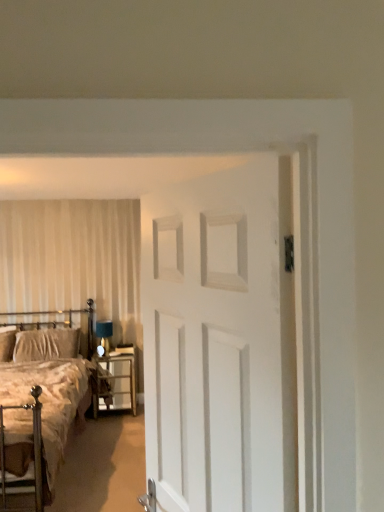
In order to face metallic silver nightstand at lower center, should I rotate leftwards or rightwards?

You should rotate left by 10.150 degrees.

Find the location of `metallic gold bed at left`. metallic gold bed at left is located at coordinates (41, 409).

In order to face white matte door at center, should I rotate leftwards or rightwards?

Turn right by 0.154 degrees to look at white matte door at center.

The height and width of the screenshot is (512, 384). I want to click on velvet beige pillow at left, so click(x=46, y=344).

The width and height of the screenshot is (384, 512). What do you see at coordinates (46, 344) in the screenshot? I see `velvet beige pillow at left` at bounding box center [46, 344].

Identify the location of metallic silver nightstand at lower center. (116, 381).

Is metallic silver headboard at left in front of or behind velvet beige pillow at left in the image?

In the image, metallic silver headboard at left appears in front of velvet beige pillow at left.

Is metallic silver headboard at left with velvet beige pillow at left?

Yes, metallic silver headboard at left and velvet beige pillow at left clearly make contact.

Would you say metallic silver headboard at left is inside or outside velvet beige pillow at left?

metallic silver headboard at left is contained in velvet beige pillow at left.

Is point (20, 330) behind point (76, 349)?

No, (20, 330) is in front of (76, 349).

Which point is more distant from viewer, (127, 397) or (45, 346)?

Point (127, 397)

Between metallic silver nightstand at lower center and metallic silver headboard at left, which one has smaller width?

Thinner between the two is metallic silver headboard at left.

From a real-world perspective, relative to metallic silver headboard at left, is metallic silver nightstand at lower center vertically above or below?

metallic silver nightstand at lower center is below metallic silver headboard at left.

Between metallic silver nightstand at lower center and metallic silver headboard at left, which one has larger size?

metallic silver headboard at left.

From the image's perspective, relative to metallic silver nightstand at lower center, is metallic silver headboard at left above or below?

metallic silver headboard at left is above metallic silver nightstand at lower center.

In the scene shown: From their relative heights in the image, would you say metallic silver headboard at left is taller or shorter than metallic silver nightstand at lower center?

metallic silver headboard at left is shorter than metallic silver nightstand at lower center.

Which object is more forward, metallic silver headboard at left or metallic silver nightstand at lower center?

metallic silver headboard at left is closer to the camera.

From a real-world perspective, is metallic silver headboard at left above or below metallic silver nightstand at lower center?

metallic silver headboard at left is above metallic silver nightstand at lower center.

Choose the correct answer: Is white matte door at center inside metallic silver headboard at left or outside it?

white matte door at center is not enclosed by metallic silver headboard at left.

Considering the sizes of objects white matte door at center and metallic silver headboard at left in the image provided, who is taller, white matte door at center or metallic silver headboard at left?

Standing taller between the two is white matte door at center.

Would you consider white matte door at center to be distant from metallic silver headboard at left?

Yes, white matte door at center and metallic silver headboard at left are located far from each other.

In the scene shown: Who is smaller, velvet beige pillow at left or metallic gold bed at left?

Smaller between the two is velvet beige pillow at left.

How many degrees apart are the facing directions of velvet beige pillow at left and metallic gold bed at left?

The angular difference between velvet beige pillow at left and metallic gold bed at left is 0.000177 degrees.

Find the location of a particular element. pillow that is behind the metallic gold bed at left is located at coordinates (46, 344).

Which of these two, velvet beige pillow at left or metallic gold bed at left, is wider?

metallic gold bed at left.

Considering the sizes of objects metallic gold bed at left and velvet beige pillow at left in the image provided, who is wider, metallic gold bed at left or velvet beige pillow at left?

Wider between the two is metallic gold bed at left.

Between metallic gold bed at left and velvet beige pillow at left, which one has more height?

Standing taller between the two is metallic gold bed at left.

Are metallic gold bed at left and velvet beige pillow at left far apart?

That's not correct — metallic gold bed at left is a little close to velvet beige pillow at left.

From the image's perspective, is metallic gold bed at left located above velvet beige pillow at left?

No, from the image's perspective, metallic gold bed at left is not over velvet beige pillow at left.

Is metallic silver headboard at left looking in the opposite direction of metallic gold bed at left?

That's right, metallic silver headboard at left is facing away from metallic gold bed at left.

Image resolution: width=384 pixels, height=512 pixels. Find the location of `bed that appears below the metallic silver headboard at left (from a real-world perspective)`. bed that appears below the metallic silver headboard at left (from a real-world perspective) is located at coordinates (41, 409).

Consider the image. Can you confirm if metallic silver headboard at left is positioned to the left of metallic gold bed at left?

Indeed, metallic silver headboard at left is positioned on the left side of metallic gold bed at left.

Do you think metallic silver headboard at left is within metallic gold bed at left, or outside of it?

metallic silver headboard at left can be found inside metallic gold bed at left.

At what (x,y) coordinates should I click in order to perform the action: click on pillow located underneath the metallic silver headboard at left (from a real-world perspective). Please return your answer as a coordinate pair (x, y). The height and width of the screenshot is (512, 384). Looking at the image, I should click on (46, 344).

Where is `nightstand behind the metallic silver headboard at left`? Image resolution: width=384 pixels, height=512 pixels. nightstand behind the metallic silver headboard at left is located at coordinates (116, 381).

Which object lies further to the anchor point metallic gold bed at left, metallic silver nightstand at lower center or white matte door at center?

white matte door at center is positioned further to the anchor metallic gold bed at left.

Looking at this image, looking at the image, which one is located closer to white matte door at center, velvet beige pillow at left or metallic gold bed at left?

metallic gold bed at left is positioned closer to the anchor white matte door at center.

When comparing their distances from metallic silver nightstand at lower center, does metallic gold bed at left or velvet beige pillow at left seem further?

metallic gold bed at left lies further to metallic silver nightstand at lower center than the other object.

From the picture: Estimate the real-world distances between objects in this image. Which object is further from metallic silver headboard at left, metallic gold bed at left or velvet beige pillow at left?

Based on the image, metallic gold bed at left appears to be further to metallic silver headboard at left.

Which object lies nearer to the anchor point metallic silver nightstand at lower center, white matte door at center or metallic gold bed at left?

Based on the image, metallic gold bed at left appears to be nearer to metallic silver nightstand at lower center.

Estimate the real-world distances between objects in this image. Which object is closer to velvet beige pillow at left, metallic silver headboard at left or white matte door at center?

metallic silver headboard at left is positioned closer to the anchor velvet beige pillow at left.

Considering their positions, is metallic gold bed at left positioned further to metallic silver headboard at left than white matte door at center?

Among the two, white matte door at center is located further to metallic silver headboard at left.

Looking at the image, which one is located closer to metallic silver headboard at left, white matte door at center or metallic gold bed at left?

Among the two, metallic gold bed at left is located nearer to metallic silver headboard at left.

Find the location of `headboard positioned between metallic gold bed at left and metallic silver nightstand at lower center from near to far`. headboard positioned between metallic gold bed at left and metallic silver nightstand at lower center from near to far is located at coordinates (46, 335).

The image size is (384, 512). Find the location of `nightstand between white matte door at center and velvet beige pillow at left from front to back`. nightstand between white matte door at center and velvet beige pillow at left from front to back is located at coordinates (116, 381).

You are a GUI agent. You are given a task and a screenshot of the screen. Output one action in this format:
    pyautogui.click(x=<x>, y=<y>)
    Task: Click on the headboard positioned between white matte door at center and metallic silver nightstand at lower center from near to far
    This screenshot has height=512, width=384.
    Given the screenshot: What is the action you would take?
    pyautogui.click(x=46, y=335)

Identify the location of bed between white matte door at center and velvet beige pillow at left from front to back. The image size is (384, 512). (41, 409).